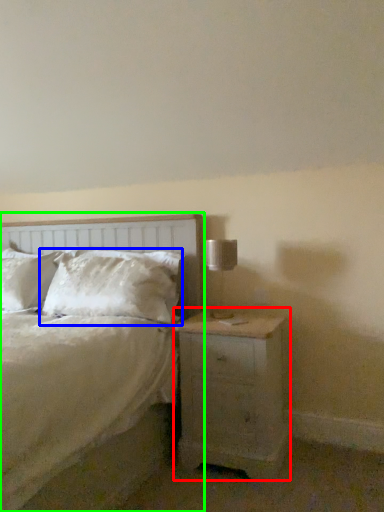
Question: Which is nearer to the nightstand (highlighted by a red box)? pillow (highlighted by a blue box) or bed (highlighted by a green box).

Choices:
 (A) pillow
 (B) bed

Answer: (A)